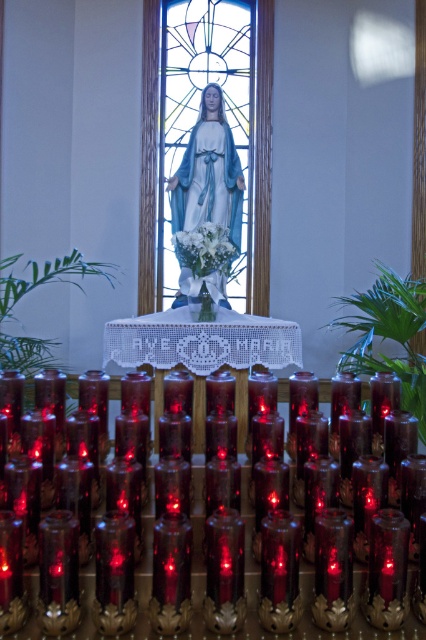
Question: Which of the following is the closest to the observer?

Choices:
 (A) (101, 490)
 (B) (163, 77)

Answer: (A)

Question: Considering the relative positions of stained glass window at center and translucent glass candle at lower center in the image provided, where is stained glass window at center located with respect to translucent glass candle at lower center?

Choices:
 (A) above
 (B) below

Answer: (A)

Question: Is stained glass window at center smaller than translucent glass candle at lower center?

Choices:
 (A) yes
 (B) no

Answer: (A)

Question: Which point appears farthest from the camera in this image?

Choices:
 (A) (241, 81)
 (B) (28, 596)

Answer: (A)

Question: Which point is closer to the camera?

Choices:
 (A) stained glass window at center
 (B) translucent glass candle at lower center

Answer: (B)

Question: Observing the image, what is the correct spatial positioning of stained glass window at center in reference to translucent glass candle at lower center?

Choices:
 (A) below
 (B) above

Answer: (B)